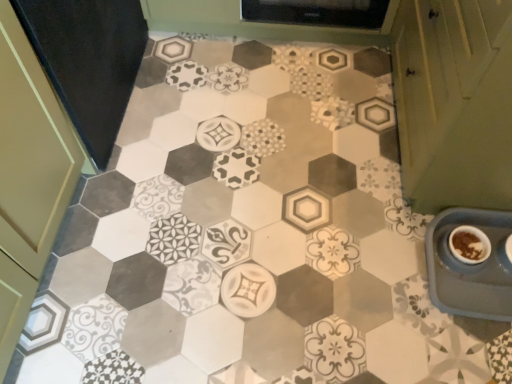
This screenshot has height=384, width=512. What do you see at coordinates (454, 102) in the screenshot?
I see `green matte cabinet at right` at bounding box center [454, 102].

In order to face brown matte bowl at lower right, should I rotate leftwards or rightwards?

A 26.299 degree turn to the right will do.

The width and height of the screenshot is (512, 384). Identify the location of blue plastic tray at lower right. (469, 266).

Find the location of a particular element. green matte cabinet at right is located at coordinates (454, 102).

Is blue plastic tray at lower right completely or partially outside of brown matte bowl at lower right?

Yes, blue plastic tray at lower right is not within brown matte bowl at lower right.

I want to click on sink below the brown matte bowl at lower right (from a real-world perspective), so click(469, 266).

How far apart are blue plastic tray at lower right and brown matte bowl at lower right?

blue plastic tray at lower right is 2.77 inches away from brown matte bowl at lower right.

From the image's perspective, is blue plastic tray at lower right located beneath brown matte bowl at lower right?

Yes, from the image's perspective, blue plastic tray at lower right is below brown matte bowl at lower right.

Is brown matte bowl at lower right bigger or smaller than green matte cabinet at right?

In the image, brown matte bowl at lower right appears to be smaller than green matte cabinet at right.

Between brown matte bowl at lower right and green matte cabinet at right, which one has more height?

With more height is green matte cabinet at right.

From the image's perspective, which is above, brown matte bowl at lower right or green matte cabinet at right?

green matte cabinet at right is shown above in the image.

Locate an element on the screen. cabinetry to the right of brown matte bowl at lower right is located at coordinates (454, 102).

In terms of size, does green matte cabinet at right appear bigger or smaller than brown matte bowl at lower right?

Clearly, green matte cabinet at right is larger in size than brown matte bowl at lower right.

Which is more distant, (426, 210) or (475, 244)?

The point (426, 210) is behind.

Is green matte cabinet at right beside blue plastic tray at lower right?

No, green matte cabinet at right is not next to blue plastic tray at lower right.

Considering the positions of point (460, 157) and point (481, 268), is point (460, 157) closer or farther from the camera than point (481, 268)?

Point (460, 157) is closer to the camera than point (481, 268).

How many degrees apart are the facing directions of green matte cabinet at right and blue plastic tray at lower right?

90.3 degrees.

Is green matte cabinet at right looking in the opposite direction of blue plastic tray at lower right?

No, green matte cabinet at right is not facing away from blue plastic tray at lower right.

How different are the orientations of blue plastic tray at lower right and green matte cabinet at right in degrees?

blue plastic tray at lower right and green matte cabinet at right are facing 90.3 degrees away from each other.

Would you say blue plastic tray at lower right is to the left or to the right of green matte cabinet at right in the picture?

Based on their positions, blue plastic tray at lower right is located to the left of green matte cabinet at right.

Is blue plastic tray at lower right positioned with its back to green matte cabinet at right?

Yes, blue plastic tray at lower right's orientation is away from green matte cabinet at right.

Is point (488, 243) positioned before point (492, 279)?

No, it is behind (492, 279).

You are a GUI agent. You are given a task and a screenshot of the screen. Output one action in this format:
    pyautogui.click(x=<x>, y=<y>)
    Task: Click on the coffee cup lying on the left of blue plastic tray at lower right
    This screenshot has height=384, width=512.
    Given the screenshot: What is the action you would take?
    pyautogui.click(x=469, y=244)

Considering the relative sizes of brown matte bowl at lower right and blue plastic tray at lower right in the image provided, is brown matte bowl at lower right bigger than blue plastic tray at lower right?

No.

What's the angular difference between brown matte bowl at lower right and blue plastic tray at lower right's facing directions?

The angular difference between brown matte bowl at lower right and blue plastic tray at lower right is 0.000466 degrees.

The image size is (512, 384). Identify the location of coffee cup on the left of blue plastic tray at lower right. (469, 244).

Identify the location of cabinetry in front of the brown matte bowl at lower right. The height and width of the screenshot is (384, 512). (454, 102).

When comparing their distances from blue plastic tray at lower right, does green matte cabinet at right or brown matte bowl at lower right seem further?

green matte cabinet at right lies further to blue plastic tray at lower right than the other object.

Estimate the real-world distances between objects in this image. Which object is closer to brown matte bowl at lower right, green matte cabinet at right or blue plastic tray at lower right?

Based on the image, blue plastic tray at lower right appears to be nearer to brown matte bowl at lower right.

Estimate the real-world distances between objects in this image. Which object is further from blue plastic tray at lower right, brown matte bowl at lower right or green matte cabinet at right?

The object further to blue plastic tray at lower right is green matte cabinet at right.

From the image, which object appears to be nearer to green matte cabinet at right, blue plastic tray at lower right or brown matte bowl at lower right?

The object closer to green matte cabinet at right is blue plastic tray at lower right.

When comparing their distances from green matte cabinet at right, does brown matte bowl at lower right or blue plastic tray at lower right seem further?

brown matte bowl at lower right is positioned further to the anchor green matte cabinet at right.

Which object lies nearer to the anchor point brown matte bowl at lower right, blue plastic tray at lower right or green matte cabinet at right?

Based on the image, blue plastic tray at lower right appears to be nearer to brown matte bowl at lower right.

Identify the location of coffee cup between green matte cabinet at right and blue plastic tray at lower right in the up-down direction. Image resolution: width=512 pixels, height=384 pixels. (469, 244).